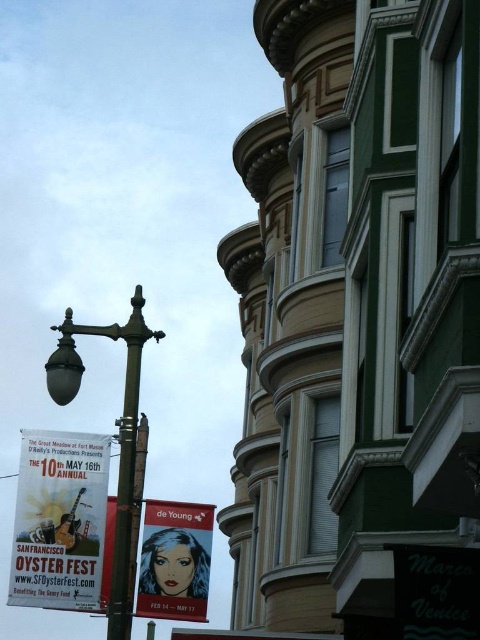
Question: Can you confirm if white paper poster at lower left is positioned above metallic pole at center?

Choices:
 (A) yes
 (B) no

Answer: (B)

Question: Which point is farther from the camera taking this photo?

Choices:
 (A) (21, 468)
 (B) (113, 625)
 (C) (78, 326)
 (D) (169, 566)

Answer: (D)

Question: Among these points, which one is nearest to the camera?

Choices:
 (A) (67, 513)
 (B) (124, 388)
 (C) (108, 332)
 (D) (200, 572)

Answer: (A)

Question: Does white paper poster at lower left lie behind metallic pole at center?

Choices:
 (A) no
 (B) yes

Answer: (B)

Question: Which point is farther from the camera taking this photo?

Choices:
 (A) (27, 490)
 (B) (135, 604)
 (C) (129, 484)
 (D) (118, 506)

Answer: (B)

Question: Can you confirm if polished brass street light at center-left is positioned below matte red banner at center?

Choices:
 (A) no
 (B) yes

Answer: (A)